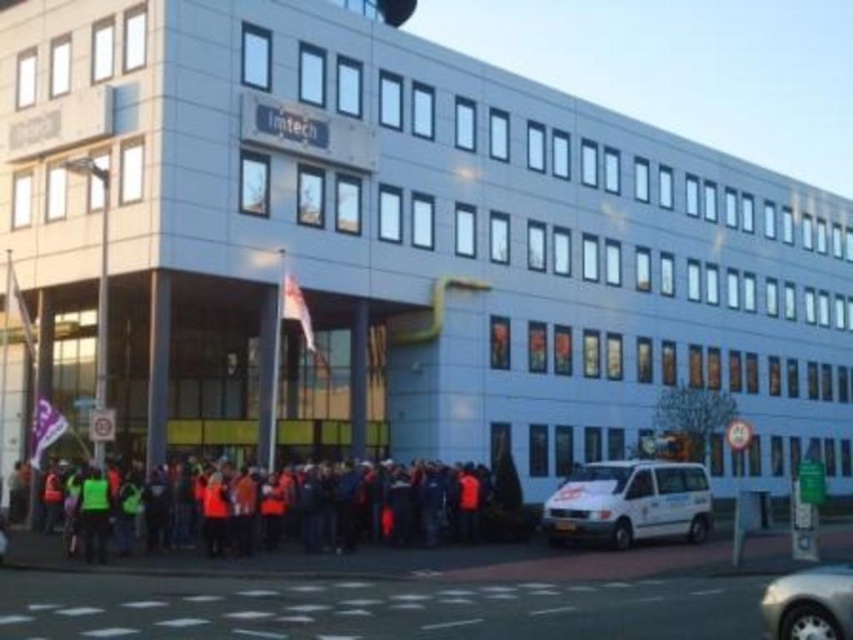
Consider the image. Does white matte van at lower right have a lesser width compared to silver metallic car at lower right?

No.

Is white matte van at lower right shorter than silver metallic car at lower right?

No, white matte van at lower right is not shorter than silver metallic car at lower right.

Who is more distant from viewer, (573, 481) or (764, 589)?

The point (573, 481) is more distant.

Find the location of a particular element. This screenshot has width=853, height=640. white matte van at lower right is located at coordinates (630, 502).

Can you confirm if orange reflective jackets at lower center is positioned above silver metallic car at lower right?

No.

Can you confirm if orange reflective jackets at lower center is shorter than silver metallic car at lower right?

In fact, orange reflective jackets at lower center may be taller than silver metallic car at lower right.

What do you see at coordinates (306, 508) in the screenshot? This screenshot has width=853, height=640. I see `orange reflective jackets at lower center` at bounding box center [306, 508].

In order to click on orange reflective jackets at lower center in this screenshot , I will do `click(306, 508)`.

Is orange reflective jackets at lower center smaller than white matte van at lower right?

No.

Is orange reflective jackets at lower center positioned in front of white matte van at lower right?

Yes, orange reflective jackets at lower center is in front of white matte van at lower right.

In the scene shown: Who is more forward, (223, 515) or (602, 492)?

Point (223, 515) is more forward.

Where is `orange reflective jackets at lower center`? orange reflective jackets at lower center is located at coordinates (306, 508).